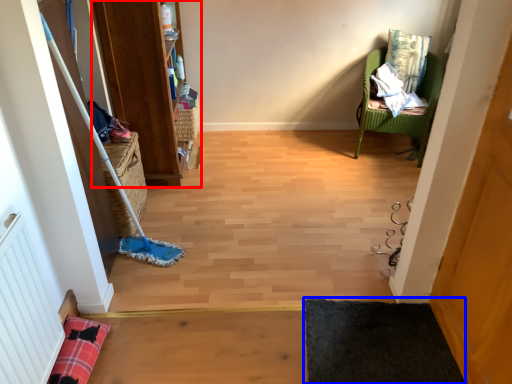
Question: Which point is closer to the camera, bookshelf (highlighted by a red box) or yoga mat (highlighted by a blue box)?

Choices:
 (A) bookshelf
 (B) yoga mat

Answer: (B)